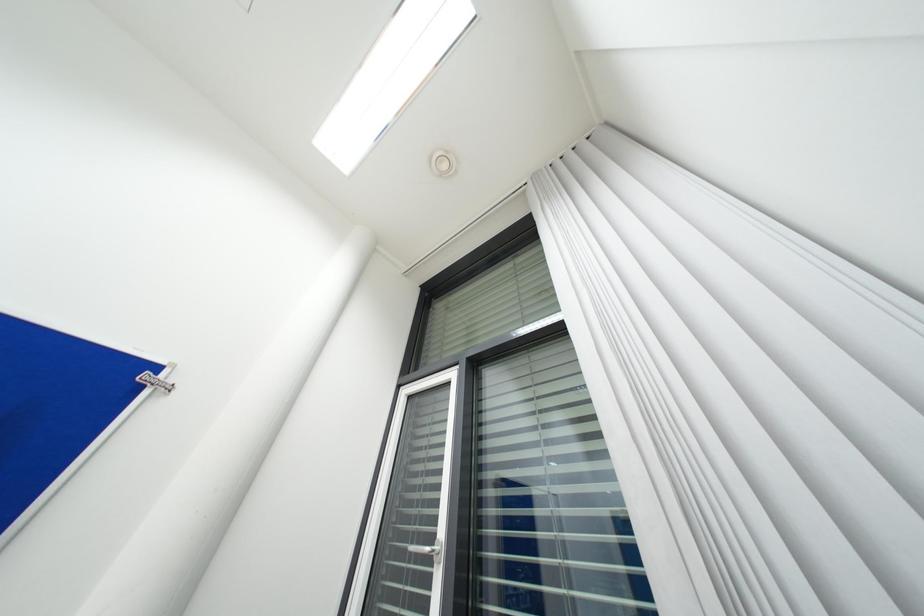
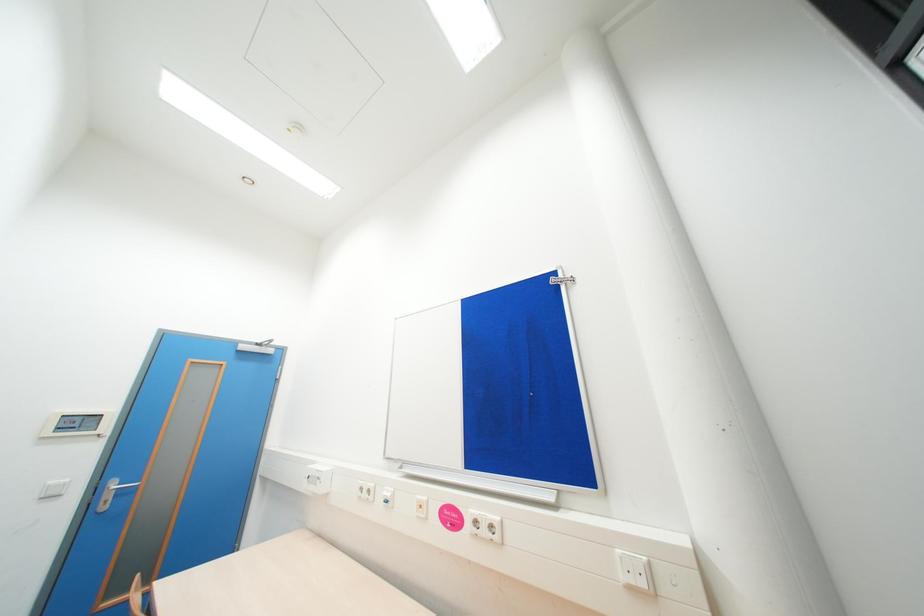
Question: Based on the continuous images, in which direction is the camera rotating? Reply with the corresponding letter.

Choices:
 (A) Left
 (B) Right
 (C) Up
 (D) Down

Answer: (A)